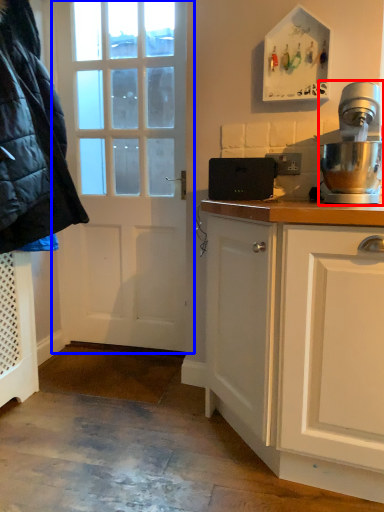
Question: Which point is closer to the camera, home appliance (highlighted by a red box) or door (highlighted by a blue box)?

Choices:
 (A) home appliance
 (B) door

Answer: (A)